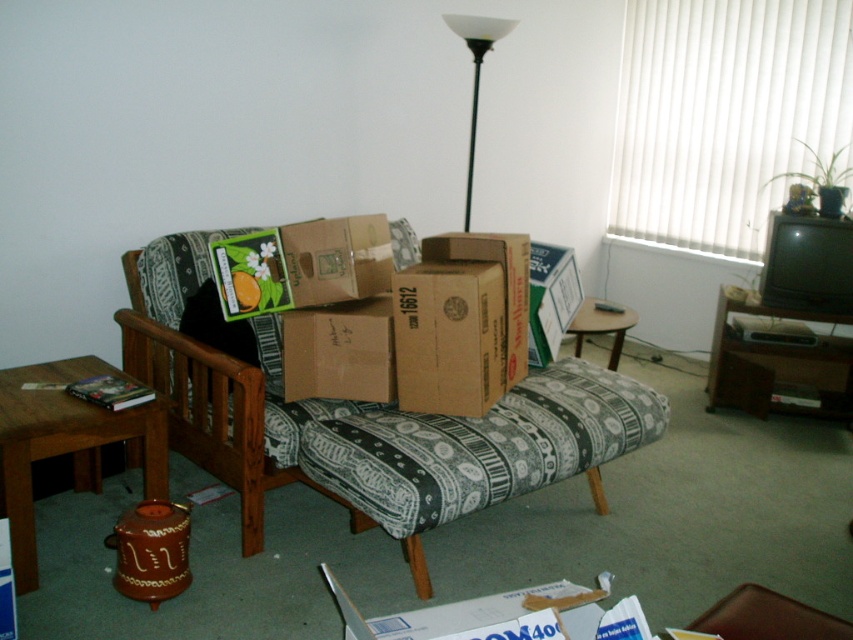
Question: Which point is farther from the camera taking this photo?

Choices:
 (A) pos(160,236)
 (B) pos(42,451)
 (C) pos(613,348)
 (D) pos(341,369)

Answer: (C)

Question: Does brown cardboard box at center have a smaller size compared to wooden round table at center?

Choices:
 (A) yes
 (B) no

Answer: (A)

Question: Which of these objects is positioned closest to the wooden round table at center?

Choices:
 (A) white matte floor lamp at upper center
 (B) brown wooden table at lower left
 (C) brown cardboard box at center
 (D) patterned fabric couch at center

Answer: (D)

Question: In this image, where is brown cardboard box at center located relative to wooden round table at center?

Choices:
 (A) below
 (B) above

Answer: (A)

Question: Which point appears farthest from the camera in this image?

Choices:
 (A) (326, 364)
 (B) (595, 333)

Answer: (B)

Question: Is the position of brown cardboard box at center more distant than that of wooden round table at center?

Choices:
 (A) no
 (B) yes

Answer: (A)